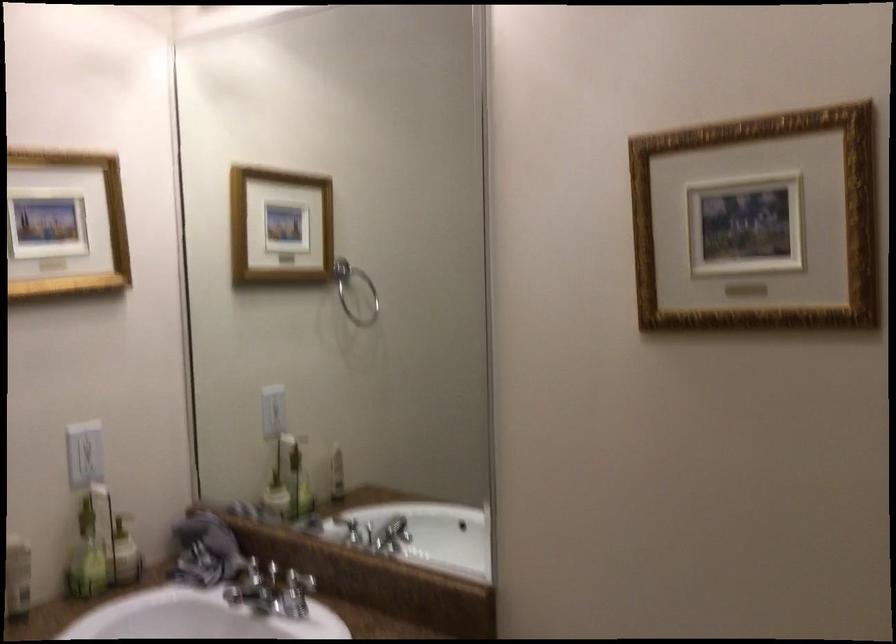
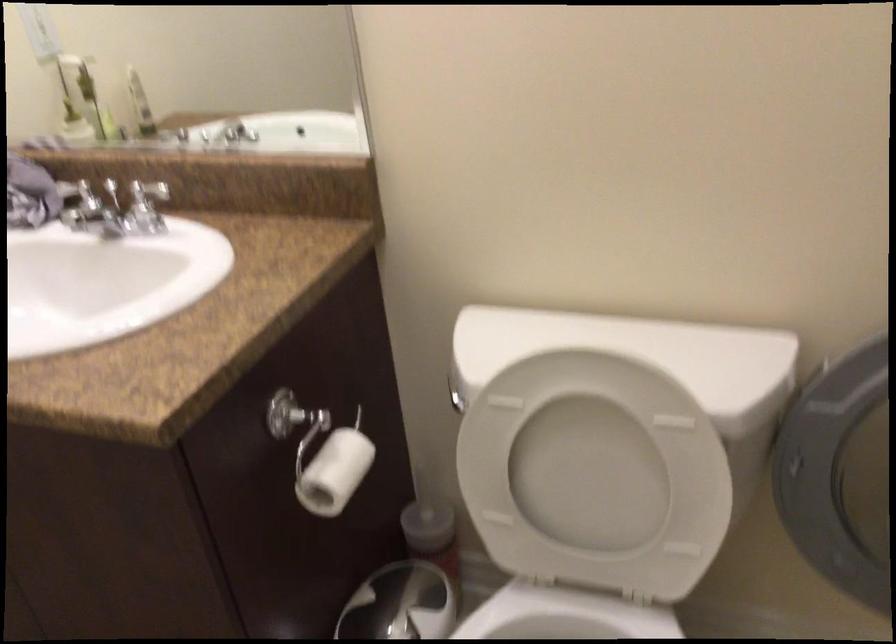
Find the pixel in the second image that matches (x=247, y=542) in the first image.

(64, 180)